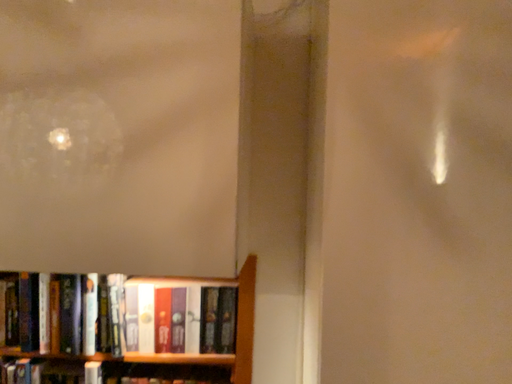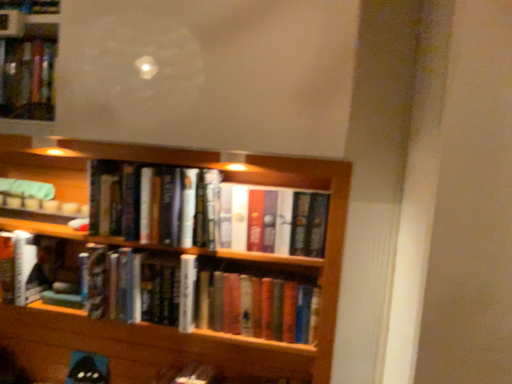
Question: Which way did the camera rotate in the video?

Choices:
 (A) rotated right
 (B) rotated left

Answer: (B)